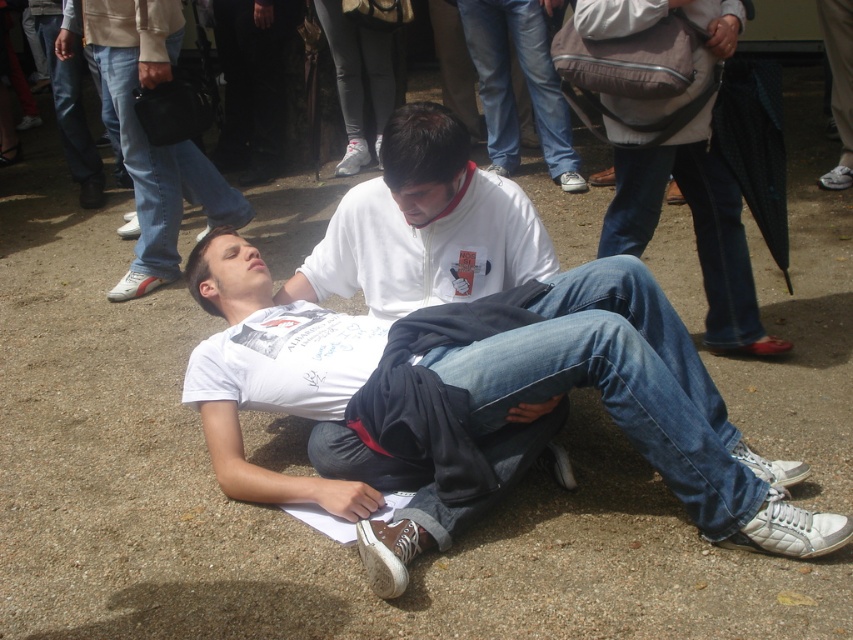
Between white matte t-shirt at center and matte brown backpack at center, which one appears on the left side from the viewer's perspective?

From the viewer's perspective, white matte t-shirt at center appears more on the left side.

Can you confirm if white matte t-shirt at center is positioned to the right of matte brown backpack at center?

In fact, white matte t-shirt at center is to the left of matte brown backpack at center.

Measure the distance between white matte t-shirt at center and camera.

A distance of 6.93 feet exists between white matte t-shirt at center and camera.

Identify the location of white matte t-shirt at center. (476, 401).

Does point (335, 449) come closer to viewer compared to point (85, 28)?

Yes.

Which is in front, point (509, 346) or point (143, 177)?

Point (509, 346) is more forward.

Is point (410, 365) closer to camera compared to point (163, 0)?

That is True.

Where is `white matte t-shirt at center`? Image resolution: width=853 pixels, height=640 pixels. white matte t-shirt at center is located at coordinates coord(476,401).

Is matte brown backpack at center positioned in front of white matte shirt at center?

Yes.

Is matte brown backpack at center below white matte shirt at center?

Yes, matte brown backpack at center is below white matte shirt at center.

This screenshot has height=640, width=853. What are the coordinates of `matte brown backpack at center` in the screenshot? It's located at coord(693,228).